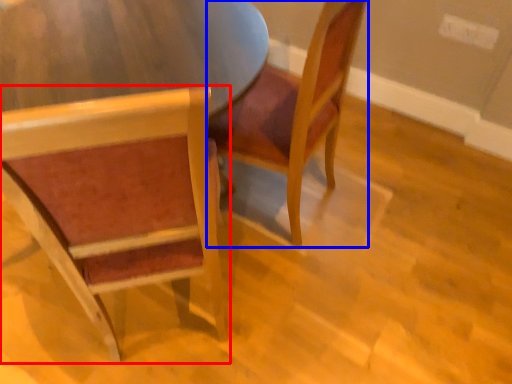
Question: Among these objects, which one is nearest to the camera, chair (highlighted by a red box) or chair (highlighted by a blue box)?

Choices:
 (A) chair
 (B) chair

Answer: (A)